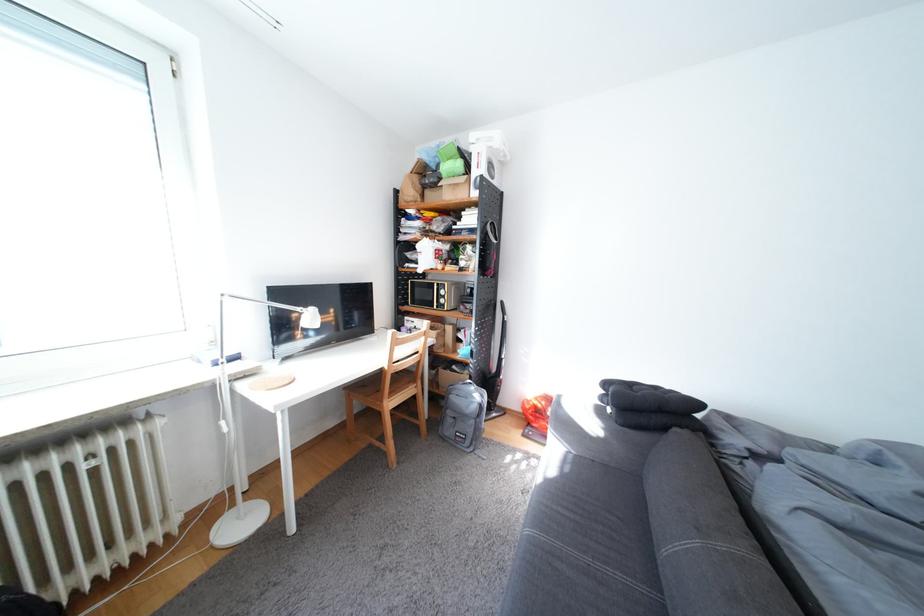
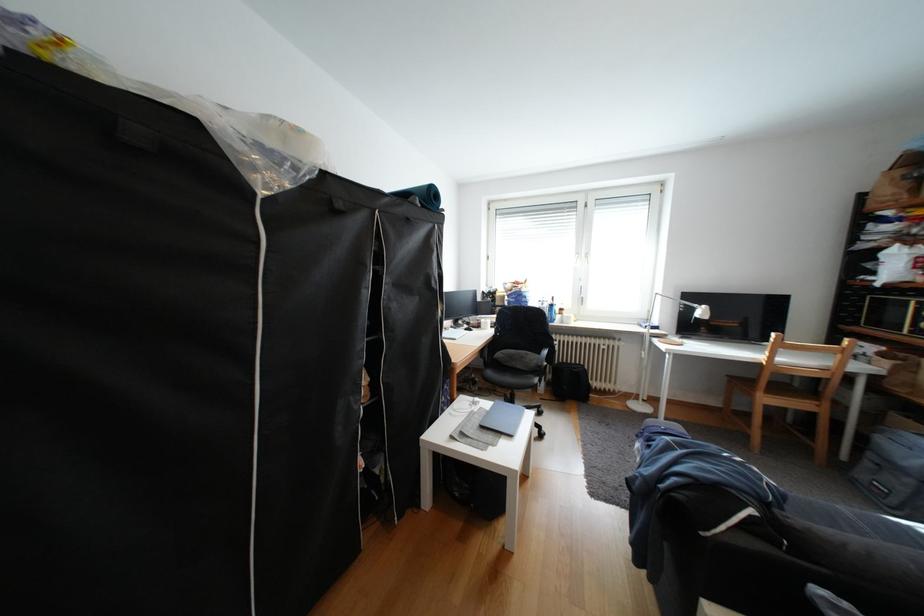
Locate, in the second image, the point that corresponds to [403,405] in the first image.

(779, 400)